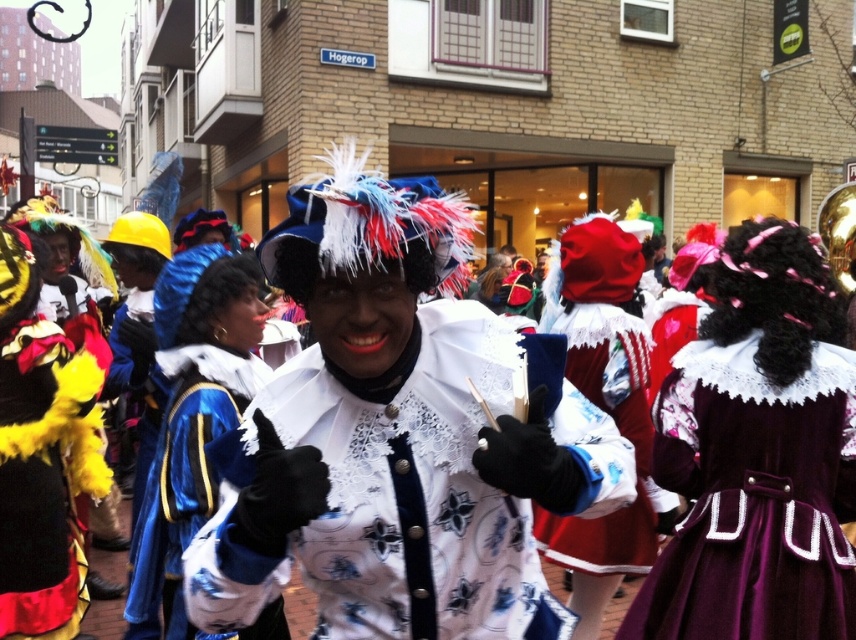
You are a photographer at the event and want to capture both the velvet maroon dress at center and the white lace coat at center in a single shot. Which direction should you move your camera to include both subjects?

The velvet maroon dress at center is to the right of the white lace coat at center, so you should move your camera slightly to the right to include both subjects in the frame.

You are a photographer at the event and want to capture both the velvet maroon dress at center and the velvet red dress at center in a single photo. Which dress should you focus on first to ensure both are in frame?

The velvet maroon dress at center is above the velvet red dress at center, so focusing on the velvet maroon dress at center first will ensure both dresses are captured in the photo.